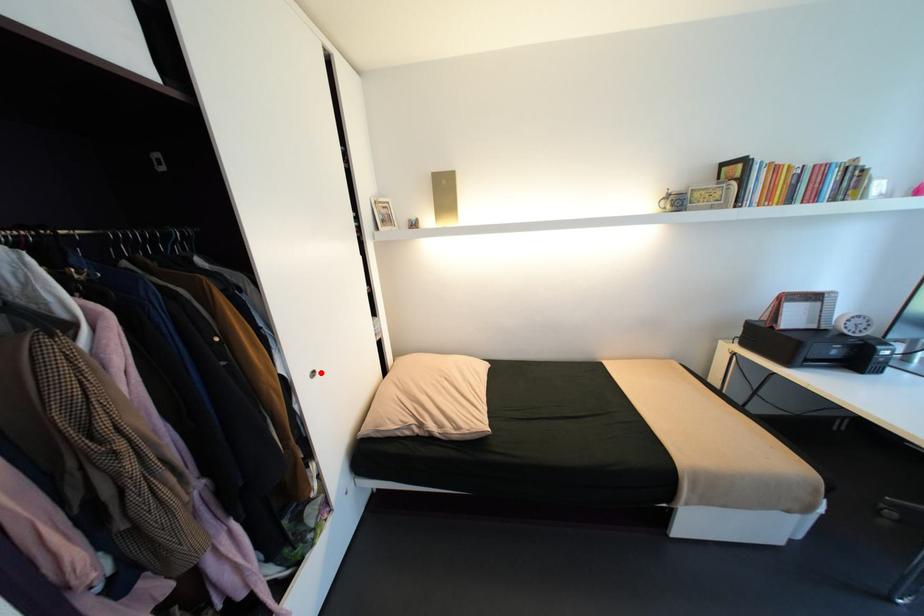
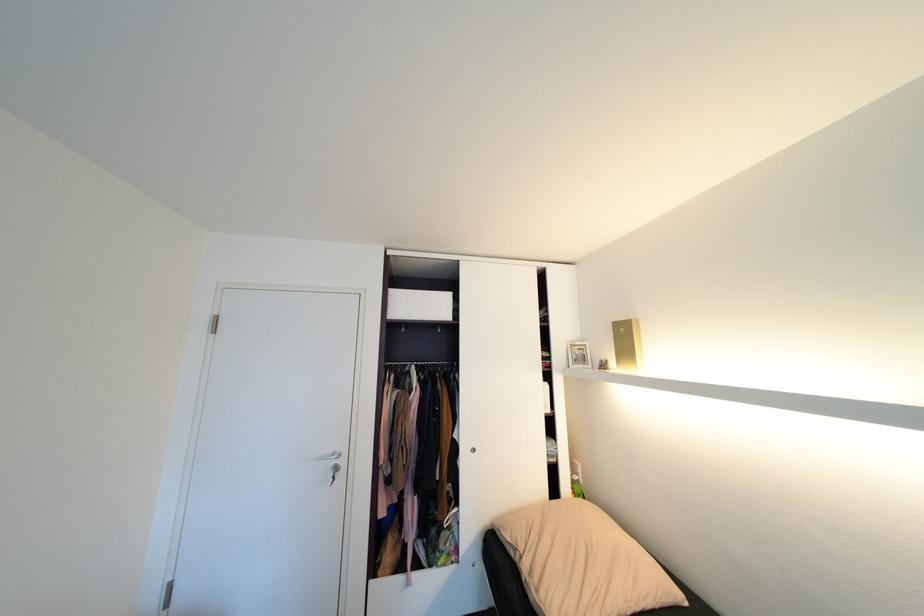
Locate, in the second image, the point that corresponds to the highlighted location in the first image.

(481, 450)